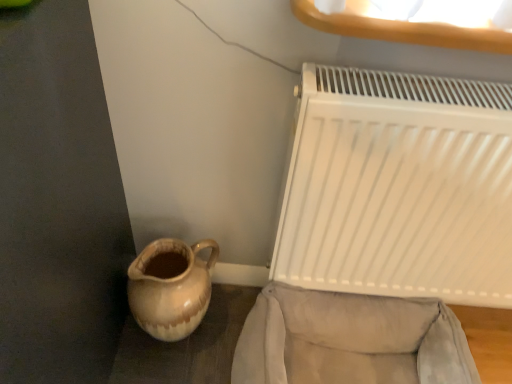
Question: Considering the relative sizes of brown glazed jug at lower left and velvet beige armchair at lower right in the image provided, is brown glazed jug at lower left taller than velvet beige armchair at lower right?

Choices:
 (A) no
 (B) yes

Answer: (B)

Question: Is brown glazed jug at lower left at the left side of velvet beige armchair at lower right?

Choices:
 (A) no
 (B) yes

Answer: (B)

Question: Does brown glazed jug at lower left come in front of velvet beige armchair at lower right?

Choices:
 (A) yes
 (B) no

Answer: (B)

Question: Can you confirm if brown glazed jug at lower left is wider than velvet beige armchair at lower right?

Choices:
 (A) yes
 (B) no

Answer: (B)

Question: Would you say brown glazed jug at lower left contains velvet beige armchair at lower right?

Choices:
 (A) no
 (B) yes

Answer: (A)

Question: Considering the positions of brown glazed jug at lower left and white matte radiator at right in the image, is brown glazed jug at lower left taller or shorter than white matte radiator at right?

Choices:
 (A) tall
 (B) short

Answer: (B)

Question: Considering the positions of brown glazed jug at lower left and white matte radiator at right in the image, is brown glazed jug at lower left wider or thinner than white matte radiator at right?

Choices:
 (A) wide
 (B) thin

Answer: (A)

Question: From a real-world perspective, relative to white matte radiator at right, is brown glazed jug at lower left vertically above or below?

Choices:
 (A) below
 (B) above

Answer: (A)

Question: From the image's perspective, is brown glazed jug at lower left above or below white matte radiator at right?

Choices:
 (A) below
 (B) above

Answer: (A)

Question: Would you say velvet beige armchair at lower right is inside or outside white matte radiator at right?

Choices:
 (A) outside
 (B) inside

Answer: (A)

Question: Is velvet beige armchair at lower right wider or thinner than white matte radiator at right?

Choices:
 (A) wide
 (B) thin

Answer: (A)

Question: In terms of height, does velvet beige armchair at lower right look taller or shorter compared to white matte radiator at right?

Choices:
 (A) tall
 (B) short

Answer: (B)

Question: From a real-world perspective, is velvet beige armchair at lower right physically located above or below white matte radiator at right?

Choices:
 (A) below
 (B) above

Answer: (A)

Question: From the image's perspective, is velvet beige armchair at lower right positioned above or below brown glazed jug at lower left?

Choices:
 (A) above
 (B) below

Answer: (B)

Question: Looking at their shapes, would you say velvet beige armchair at lower right is wider or thinner than brown glazed jug at lower left?

Choices:
 (A) thin
 (B) wide

Answer: (B)